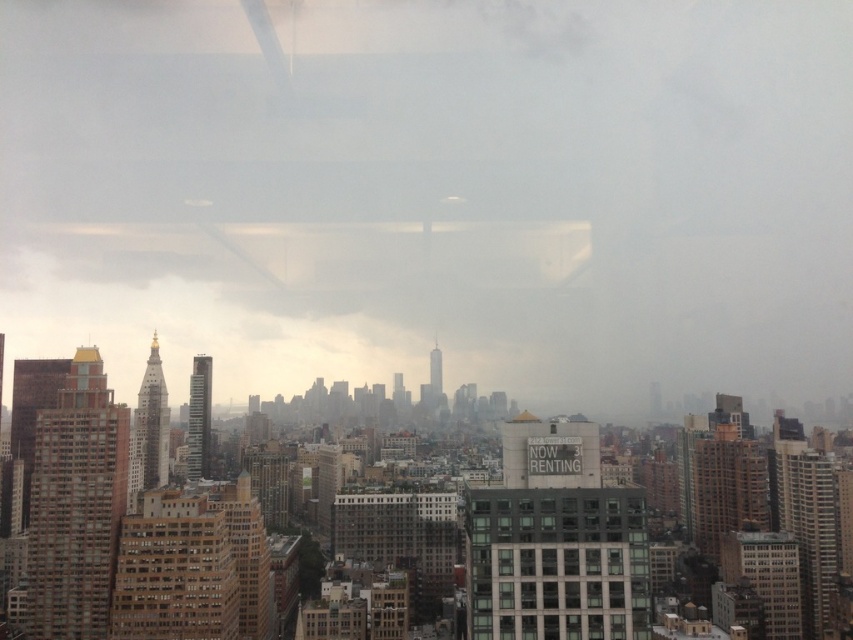
Question: Is transparent glass cloud at center wider than dark gray glass windows at center?

Choices:
 (A) no
 (B) yes

Answer: (B)

Question: Is transparent glass cloud at center bigger than dark gray glass windows at center?

Choices:
 (A) no
 (B) yes

Answer: (B)

Question: Does transparent glass cloud at center come in front of dark gray glass windows at center?

Choices:
 (A) no
 (B) yes

Answer: (A)

Question: Which point appears farthest from the camera in this image?

Choices:
 (A) (729, 120)
 (B) (573, 497)

Answer: (A)

Question: Which point is closer to the camera?

Choices:
 (A) (846, 140)
 (B) (473, 534)

Answer: (B)